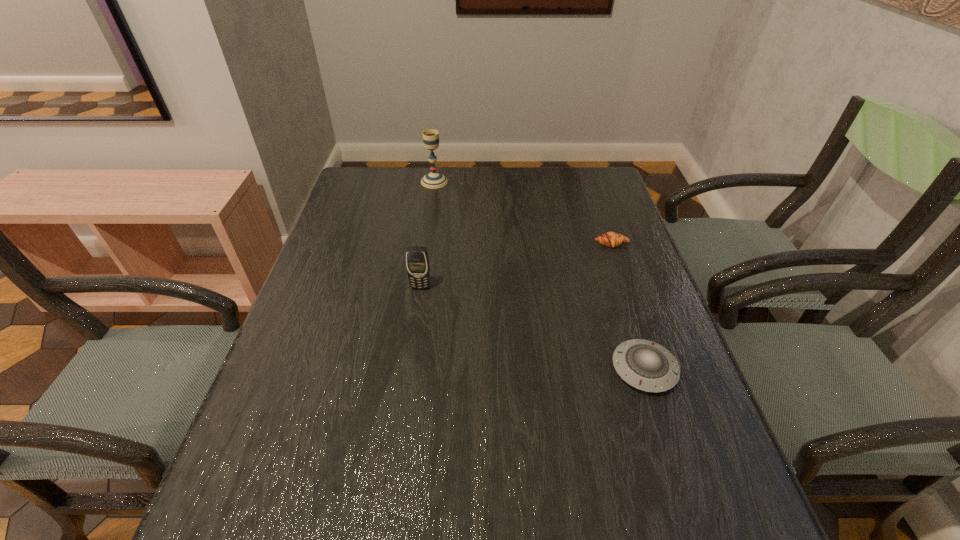
The image size is (960, 540). In order to click on the farthest object in this screenshot , I will do `click(433, 180)`.

Locate an element on the screen. Image resolution: width=960 pixels, height=540 pixels. chalice is located at coordinates (433, 180).

Identify the location of cellular telephone. The image size is (960, 540). (417, 263).

Find the location of a particular element. The image size is (960, 540). the second tallest object is located at coordinates (417, 263).

The width and height of the screenshot is (960, 540). What are the coordinates of `saucer` in the screenshot? It's located at (645, 365).

This screenshot has height=540, width=960. What are the coordinates of `pastry` in the screenshot? It's located at (610, 239).

Identify the location of vacant space located on the left of the chalice. (373, 181).

At what (x,y) coordinates should I click in order to perform the action: click on vacant space located 0.390m on the front face of the second tallest object. Please return your answer as a coordinate pair (x, y). The image size is (960, 540). Looking at the image, I should click on 399,438.

Where is `free space located on the left of the nearest object`? This screenshot has height=540, width=960. free space located on the left of the nearest object is located at coordinates (460, 369).

The image size is (960, 540). I want to click on vacant space positioned on the front-facing side of the pastry, so click(631, 302).